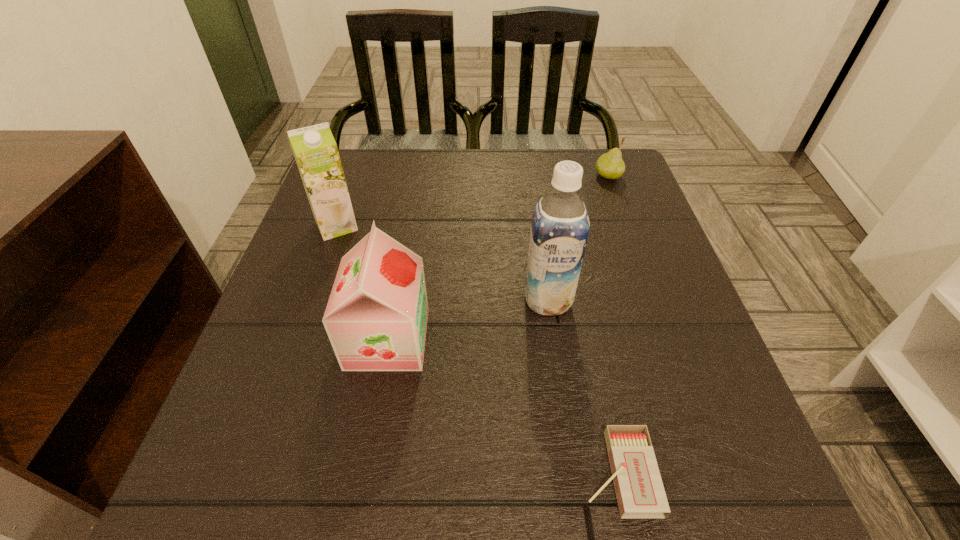
This screenshot has width=960, height=540. In order to click on free spot located on the back of the leftmost soya milk in this screenshot , I will do `click(361, 156)`.

Where is `vacant area situated with the cap open on the second soya milk from left to right`? The width and height of the screenshot is (960, 540). vacant area situated with the cap open on the second soya milk from left to right is located at coordinates (565, 339).

You are a GUI agent. You are given a task and a screenshot of the screen. Output one action in this format:
    pyautogui.click(x=<x>, y=<y>)
    Task: Click on the free space located 0.130m on the front of the farthest object
    
    Given the screenshot: What is the action you would take?
    pyautogui.click(x=622, y=215)

At what (x,y) coordinates should I click in order to perform the action: click on free region located 0.130m on the striking surface of the nearest object. Please return your answer as a coordinate pair (x, y). Looking at the image, I should click on (492, 472).

You are a GUI agent. You are given a task and a screenshot of the screen. Output one action in this format:
    pyautogui.click(x=<x>, y=<y>)
    Task: Click on the vacant space situated on the striking surface of the nearest object
    The image size is (960, 540).
    Given the screenshot: What is the action you would take?
    pyautogui.click(x=358, y=472)

The height and width of the screenshot is (540, 960). I want to click on vacant position located 0.140m on the striking surface of the nearest object, so click(x=485, y=472).

The image size is (960, 540). Identify the location of object that is at the far edge. (610, 165).

Identify the location of object at the near edge. (640, 493).

Find the location of `object present at the left edge`. object present at the left edge is located at coordinates (315, 150).

Where is `pear located in the right edge section of the desktop`? pear located in the right edge section of the desktop is located at coordinates (610, 165).